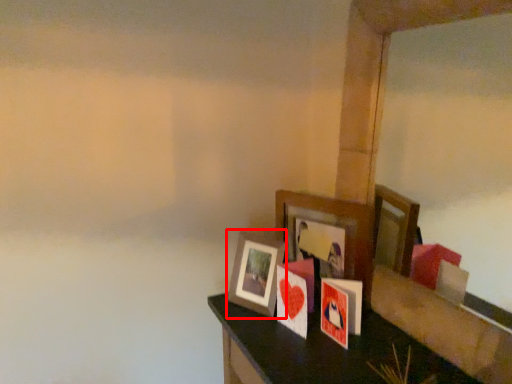
Question: From the image's perspective, where is picture frame (annotated by the red box) located in relation to picture frame in the image?

Choices:
 (A) below
 (B) above

Answer: (A)